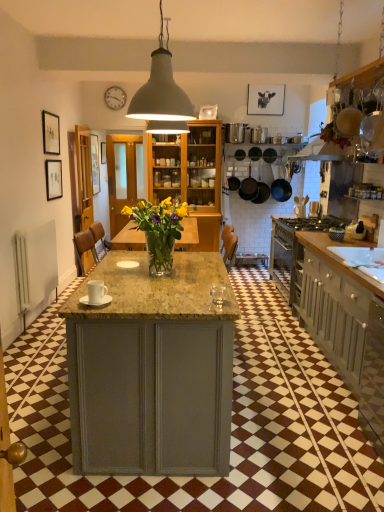
Question: Does point (264, 189) appear closer or farther from the camera than point (266, 101)?

Choices:
 (A) closer
 (B) farther

Answer: (B)

Question: Is dark brown matte frying pan at center, acting as the third frying pan starting from the back, to the left or to the right of matte black cow portrait at upper center, which is the 4th picture frame in front-to-back order, in the image?

Choices:
 (A) left
 (B) right

Answer: (A)

Question: Estimate the real-world distances between objects in this image. Which object is farther from the matte black picture frame at left, the second picture frame when ordered from front to back?

Choices:
 (A) matte gray cabinet at right
 (B) matte white picture frame at upper center, the 3th picture frame when ordered from bottom to top
 (C) white ceramic mug at center, which is the 2th appliance from right to left
 (D) matte black frying pan at center, which appears as the 1th frying pan when viewed from the back
 (E) white glossy toaster at right, which appears as the second appliance when viewed from the left

Answer: (E)

Question: Which object is positioned farthest from the matte gray pendant lamp at upper center?

Choices:
 (A) white glossy sink at right
 (B) metallic silver canisters at upper center
 (C) matte white picture frame at upper center, which ranks as the 2th picture frame in back-to-front order
 (D) black matte frying pan at center, arranged as the 2th frying pan when viewed from the back
 (E) dark brown matte frying pan at center, acting as the third frying pan starting from the back

Answer: (A)